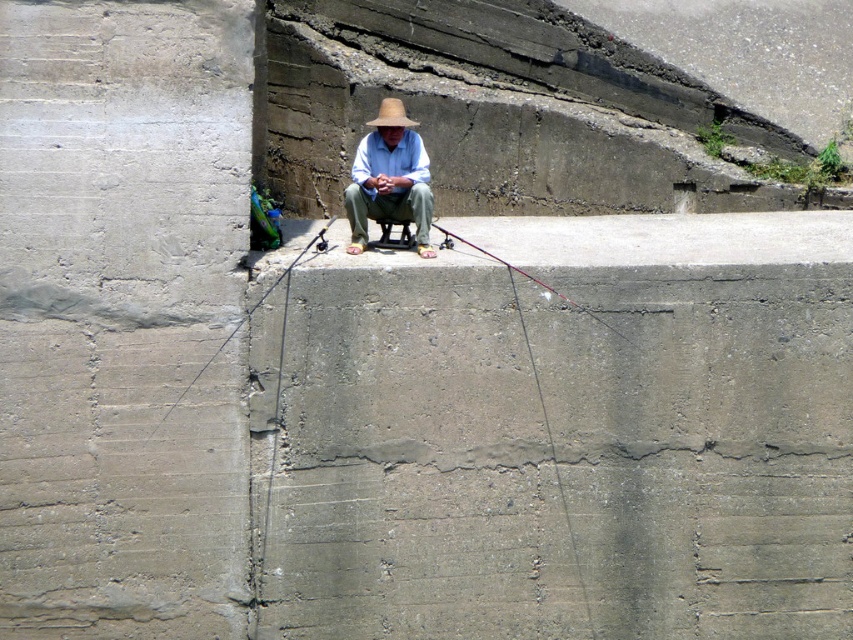
You are a photographer trying to capture the man fishing. You notice two straw hats in the scene. Which hat would appear larger in your photo if you focus on the matte straw hat at center and the beige woven straw hat at center?

The matte straw hat at center appears larger because it is closer to the viewer than the beige woven straw hat at center.

You are standing at a safe distance and want to throw a small pebble to hit the matte straw hat at center. Based on the scene description, is the distance feasible for an average adult to throw a pebble that far?

The matte straw hat at center is 11.95 meters away from the viewer. An average adult can throw a pebble up to approximately 15 meters, so it is feasible to attempt the throw.